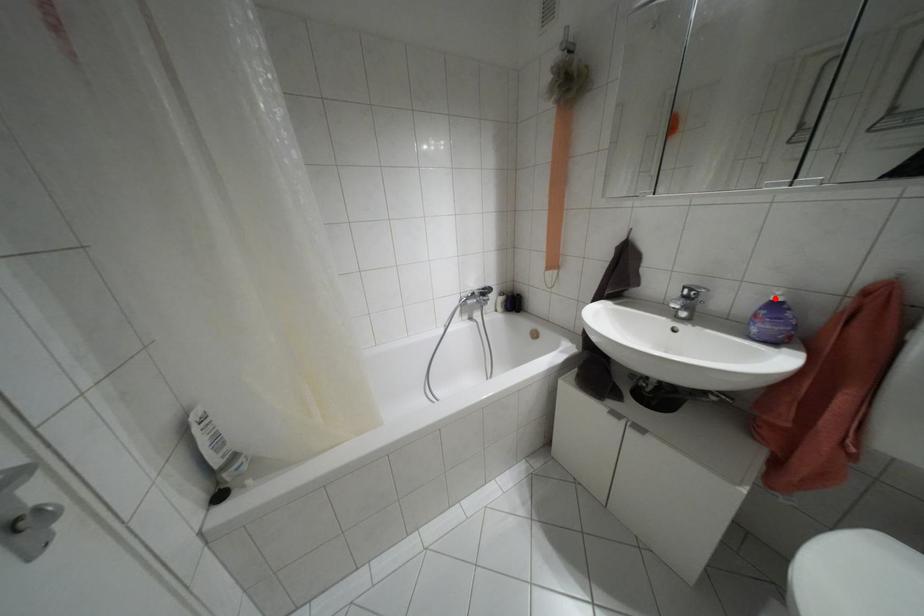
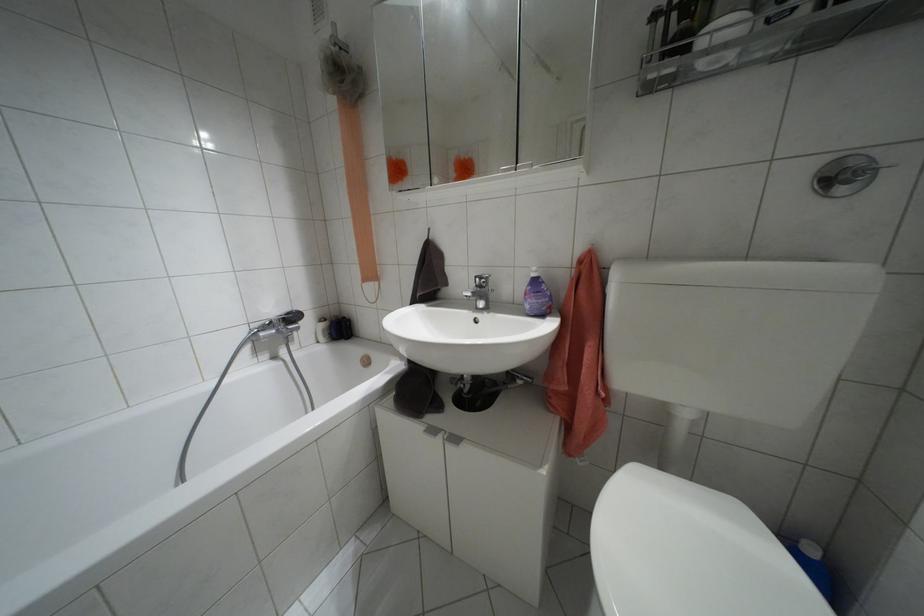
Find the pixel in the second image that matches the highlighted location in the first image.

(532, 274)